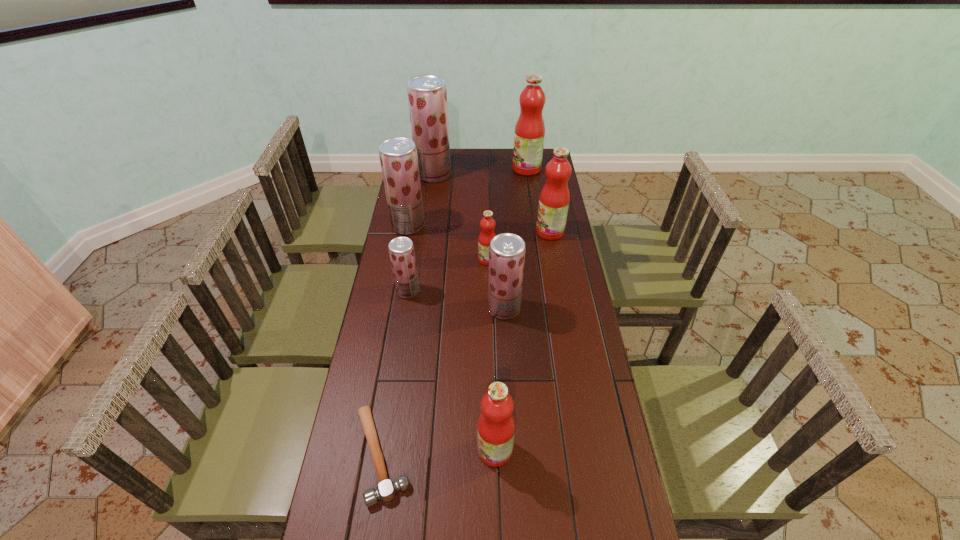
At what (x,y) coordinates should I click in order to perform the action: click on pink fruit juice that is the second closest to the farthest pink fruit juice. Please return your answer as a coordinate pair (x, y). The width and height of the screenshot is (960, 540). Looking at the image, I should click on (487, 224).

Locate which strawberry fruit juice ranks third in proximity to the shortest object. Please provide its 2D coordinates. Your answer should be formatted as a tuple, i.e. [(x, y)], where the tuple contains the x and y coordinates of a point satisfying the conditions above.

[(398, 156)]

The height and width of the screenshot is (540, 960). What are the coordinates of `strawberry fruit juice identified as the closest to the third smallest pink fruit juice` in the screenshot? It's located at (507, 251).

Identify the location of vacant position in the image that satisfies the following two spatial constraints: 1. on the back side of the farthest strawberry fruit juice; 2. on the right side of the smallest strawberry fruit juice. The height and width of the screenshot is (540, 960). (426, 174).

Where is `vacant space that satisfies the following two spatial constraints: 1. on the front label of the rightmost strawberry fruit juice; 2. on the left side of the fourth nearest fruit juice`? vacant space that satisfies the following two spatial constraints: 1. on the front label of the rightmost strawberry fruit juice; 2. on the left side of the fourth nearest fruit juice is located at coordinates (488, 308).

Where is `vacant area in the image that satisfies the following two spatial constraints: 1. on the front label of the biggest pink fruit juice; 2. on the front side of the second farthest strawberry fruit juice`? vacant area in the image that satisfies the following two spatial constraints: 1. on the front label of the biggest pink fruit juice; 2. on the front side of the second farthest strawberry fruit juice is located at coordinates (535, 226).